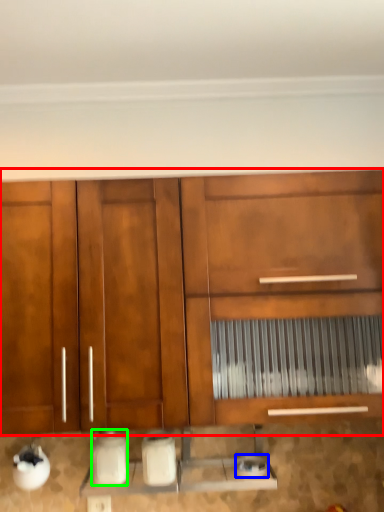
Question: Considering the real-world distances, which object is farthest from cabinetry (highlighted by a red box)? appliance (highlighted by a blue box) or appliance (highlighted by a green box)?

Choices:
 (A) appliance
 (B) appliance

Answer: (A)